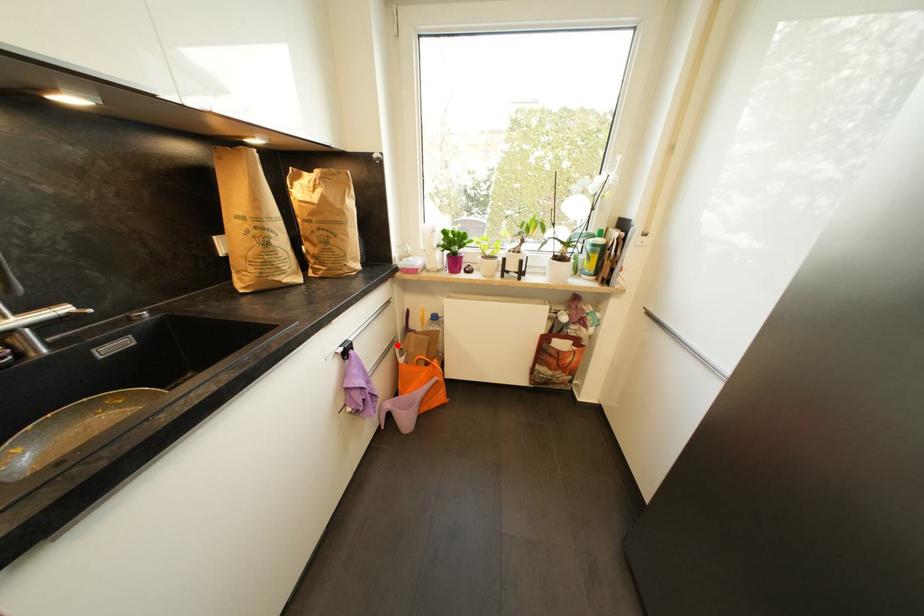
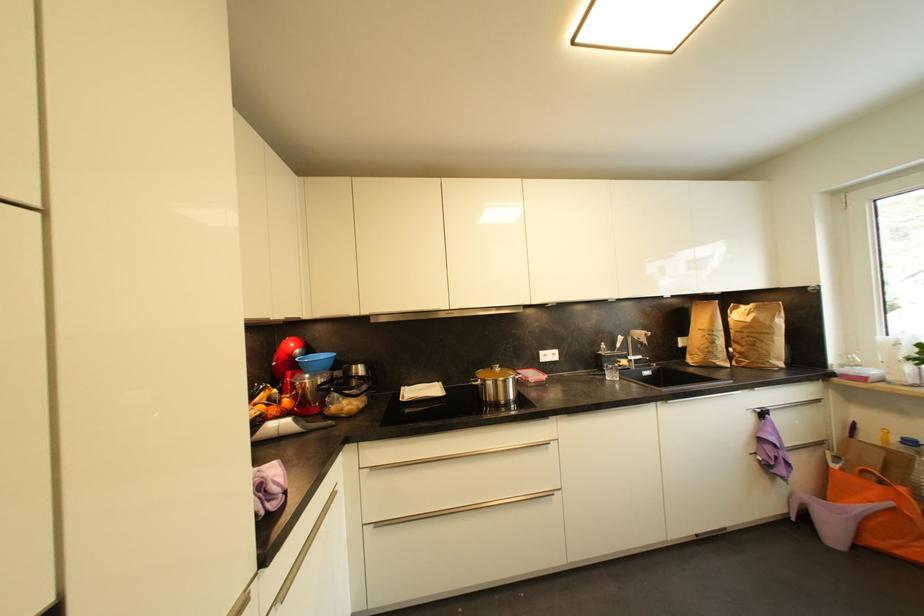
Question: I am providing you with two images of the same scene from different viewpoints. Image1 has a red point marked. In image2, the corresponding 3D location appears at what relative position? Reply with the corresponding letter.

Choices:
 (A) Closer
 (B) Farther

Answer: (A)